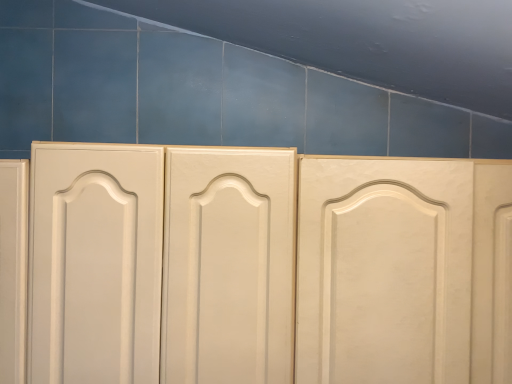
Describe the element at coordinates (253, 267) in the screenshot. I see `matte white cabinet at center` at that location.

This screenshot has width=512, height=384. What are the coordinates of `matte white cabinet at center` in the screenshot? It's located at (253, 267).

You are a GUI agent. You are given a task and a screenshot of the screen. Output one action in this format:
    pyautogui.click(x=<x>, y=<y>)
    Task: Click on the matte white cabinet at center
    This screenshot has height=384, width=512.
    Given the screenshot: What is the action you would take?
    pyautogui.click(x=253, y=267)